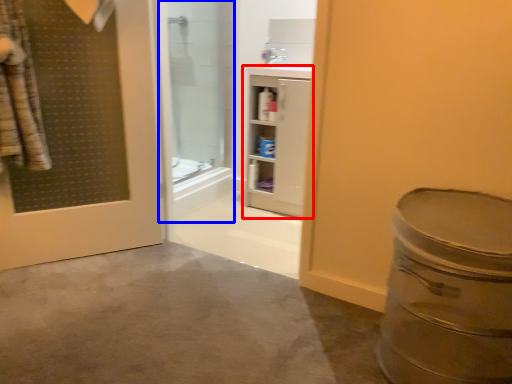
Question: Which point is closer to the camera, bathroom cabinet (highlighted by a red box) or shower door (highlighted by a blue box)?

Choices:
 (A) bathroom cabinet
 (B) shower door

Answer: (B)